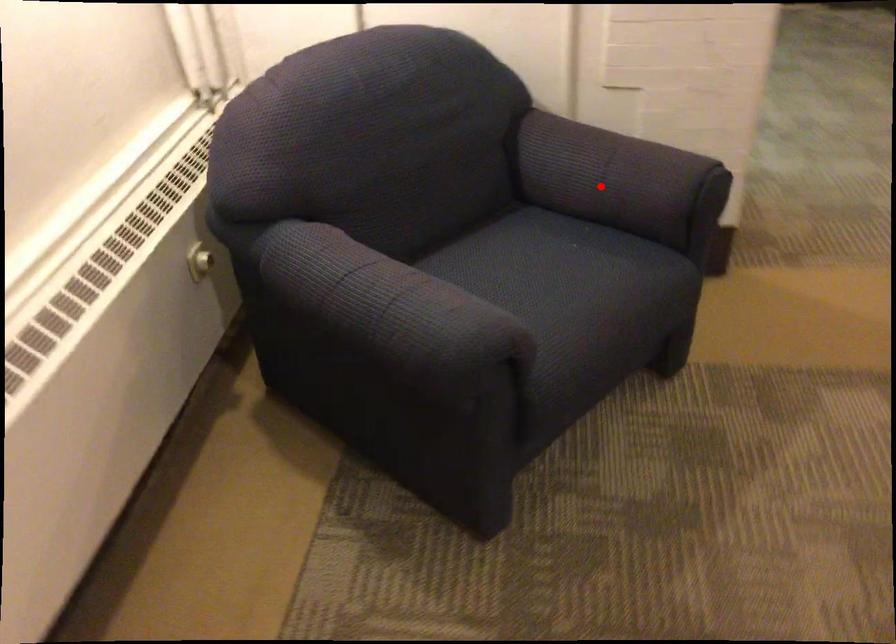
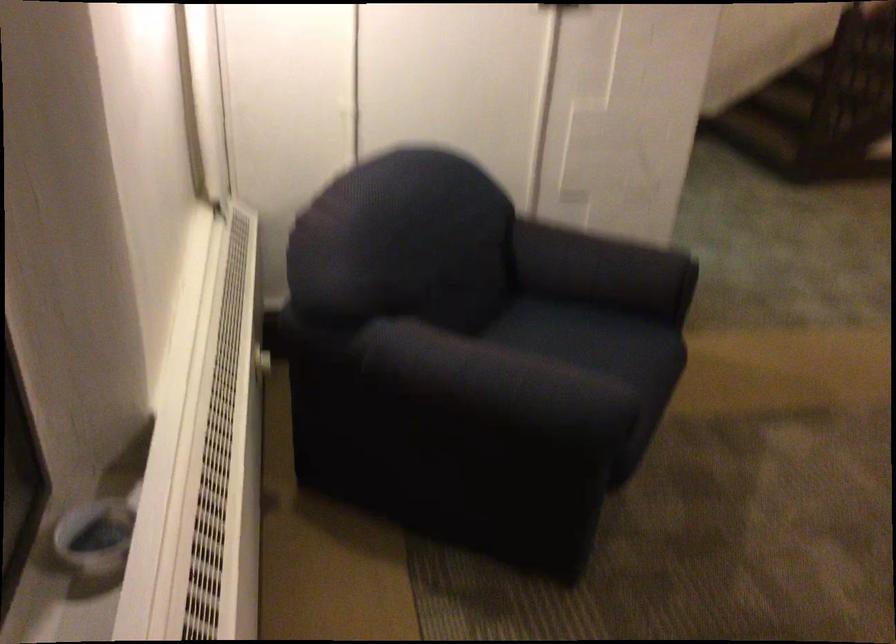
The point at the highlighted location is marked in the first image. Where is the corresponding point in the second image?

(604, 270)